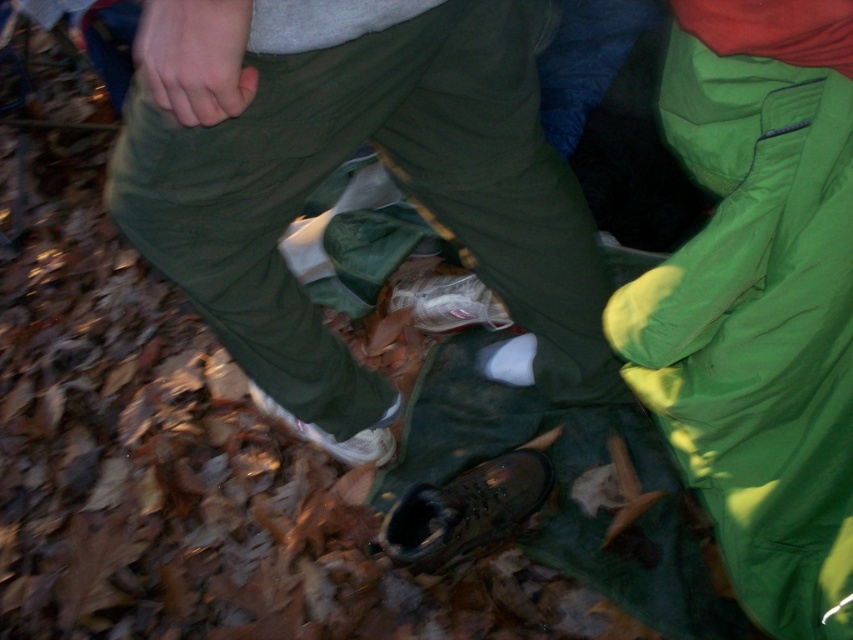
You are a photographer trying to capture the exact position of the green matte pants at center in the image. According to the coordinates provided, where would you position your camera to ensure the pants are centered in the frame?

The green matte pants at center are located at coordinates point (335, 166), so positioning the camera to center the frame at those coordinates would ensure the pants are centered.

You are standing at the origin point in the image. There is a point marked at coordinates point (x=335, y=166). What object is located at that point?

The point (x=335, y=166) corresponds to the green matte pants at center.

You are trying to determine the spatial relationship between the green matte pants at center and the white matte shoe at lower center. Based on the scene, which object is positioned to the right of the other?

The green matte pants at center is to the right of the white matte shoe at lower center.